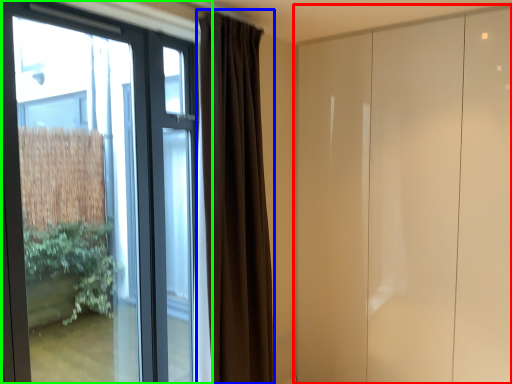
Question: Considering the real-world distances, which object is closest to door (highlighted by a red box)? curtain (highlighted by a blue box) or window (highlighted by a green box).

Choices:
 (A) curtain
 (B) window

Answer: (A)